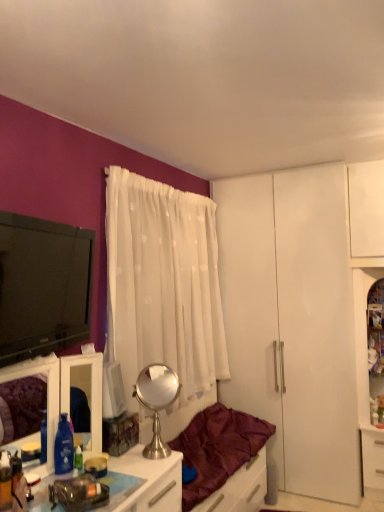
Question: In terms of size, does polished silver mirror at center appear bigger or smaller than white sheer curtain at center?

Choices:
 (A) small
 (B) big

Answer: (A)

Question: From a real-world perspective, relative to white sheer curtain at center, is polished silver mirror at center vertically above or below?

Choices:
 (A) below
 (B) above

Answer: (A)

Question: Estimate the real-world distances between objects in this image. Which object is closer to the black glossy television at left?

Choices:
 (A) translucent plastic desk at lower left
 (B) velvet burgundy studio couch at center
 (C) white sheer curtain at center
 (D) clear glass cabinet at right
 (E) metallic silver vanity at lower left

Answer: (E)

Question: Estimate the real-world distances between objects in this image. Which object is closer to the white matte drawer at lower right?

Choices:
 (A) black glossy television at left
 (B) polished silver mirror at center
 (C) translucent plastic desk at lower left
 (D) clear glass cabinet at right
 (E) velvet burgundy studio couch at center

Answer: (D)